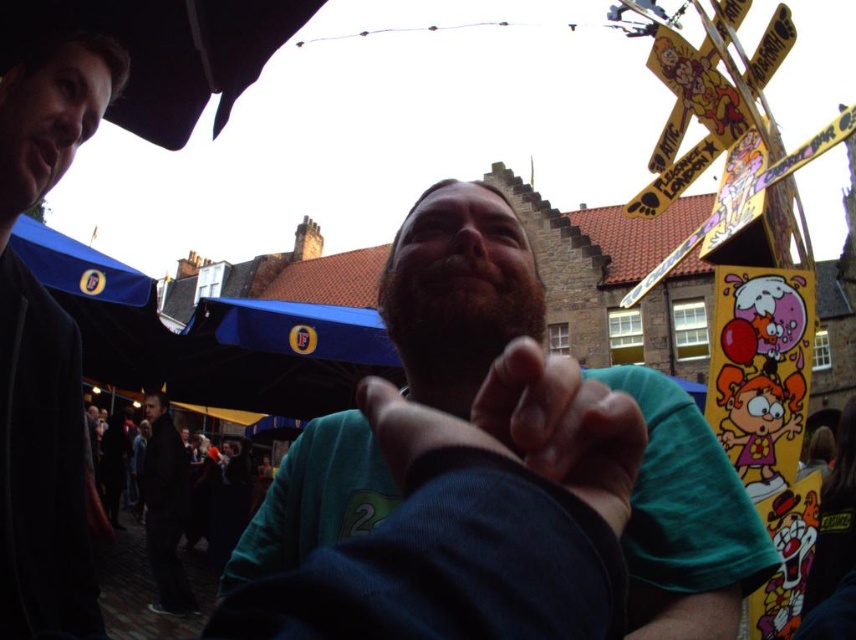
Can you confirm if dark blue jacket at left is positioned to the right of green matte hand at center?

In fact, dark blue jacket at left is to the left of green matte hand at center.

Between point (39, 72) and point (547, 356), which one is positioned in front?

Point (547, 356) is more forward.

This screenshot has height=640, width=856. What are the coordinates of `dark blue jacket at left` in the screenshot? It's located at (45, 346).

Which of these two, green matte shirt at center or dark gray suit at lower left, stands taller?

green matte shirt at center

Does point (690, 404) lie behind point (165, 580)?

That is False.

What do you see at coordinates (685, 520) in the screenshot? Image resolution: width=856 pixels, height=640 pixels. I see `green matte shirt at center` at bounding box center [685, 520].

You are a GUI agent. You are given a task and a screenshot of the screen. Output one action in this format:
    pyautogui.click(x=<x>, y=<y>)
    Task: Click on the green matte shirt at center
    This screenshot has height=640, width=856.
    Given the screenshot: What is the action you would take?
    pyautogui.click(x=685, y=520)

Is green matte hand at center above dark gray suit at lower left?

Yes, green matte hand at center is above dark gray suit at lower left.

Is green matte hand at center shorter than dark gray suit at lower left?

Correct, green matte hand at center is not as tall as dark gray suit at lower left.

Measure the distance between green matte hand at center and camera.

green matte hand at center is 47.55 meters away from camera.

Identify the location of green matte hand at center. (522, 428).